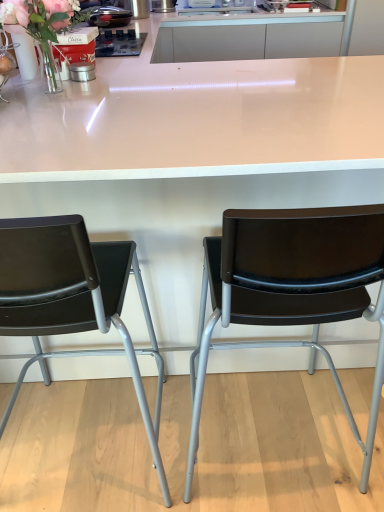
Question: Considering the positions of white glossy table at center and black plastic chair at center, which is counted as the 2th chair, starting from the left, in the image, is white glossy table at center wider or thinner than black plastic chair at center, which is counted as the 2th chair, starting from the left,?

Choices:
 (A) wide
 (B) thin

Answer: (A)

Question: Would you say white glossy table at center is inside or outside black plastic chair at center, which is counted as the 2th chair, starting from the left?

Choices:
 (A) outside
 (B) inside

Answer: (A)

Question: Which of these objects is positioned closest to the metallic tin at upper left, the second appliance viewed from the left?

Choices:
 (A) black plastic chair at center, the 1th chair in the right-to-left sequence
 (B) metallic silver canister at center, which appears as the third appliance when viewed from the left
 (C) white glossy table at center
 (D) matte black chair at left, the 2th chair viewed from the right
 (E) glossy metallic waffle maker at upper center, the second appliance when ordered from front to back

Answer: (E)

Question: Considering the real-world distances, which object is closest to the metallic tin at upper left, arranged as the 2th appliance when viewed from the right?

Choices:
 (A) black plastic chair at center, the 1th chair in the right-to-left sequence
 (B) glossy metallic waffle maker at upper center, the second appliance when ordered from front to back
 (C) translucent glass vase at upper left
 (D) matte black chair at left, the 2th chair viewed from the right
 (E) white glossy table at center

Answer: (C)